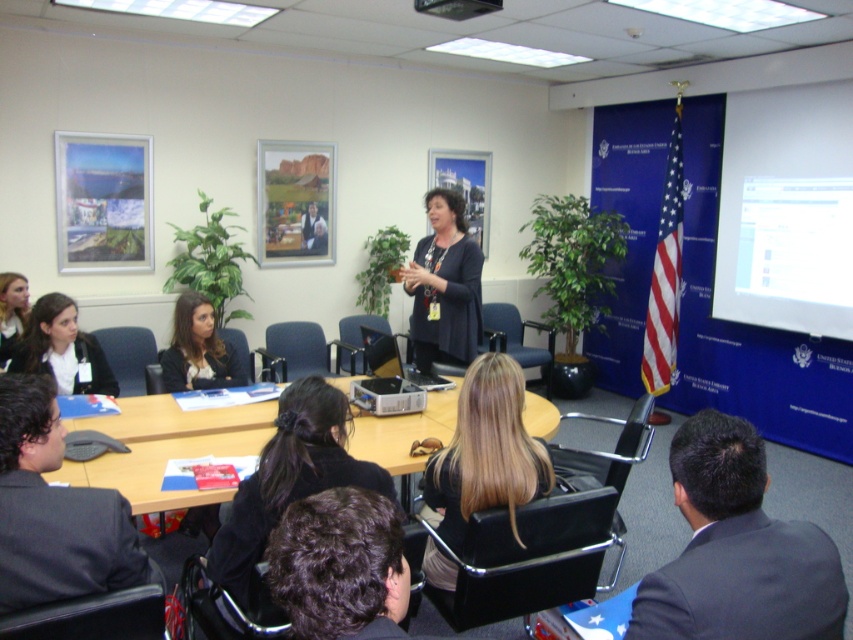
You are a photographer in the conference room and want to take a photo of the dark gray suit at lower left and the black fabric hair at center. Which object should you focus on first if you want to capture both in a single shot without moving the camera?

The dark gray suit at lower left is above the black fabric hair at center, so you should focus on the dark gray suit at lower left first to ensure both are in the frame.

You are a cleaning robot with a height of 1.5 meters. You are currently at the point marked as point (178,349) in the conference room. The ceiling height of the room is 3.5 meters. Can you safely move to another location without hitting your head?

The point (178,349) is 3.77 meters away from the viewer. The ceiling height is 3.5 meters, so the robot cannot safely move to another location without hitting its head since its height exceeds the ceiling clearance.